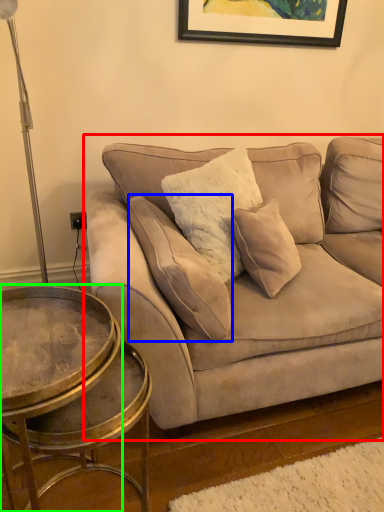
Question: Which is farther away from studio couch (highlighted by a red box)? pillow (highlighted by a blue box) or coffee table (highlighted by a green box)?

Choices:
 (A) pillow
 (B) coffee table

Answer: (B)